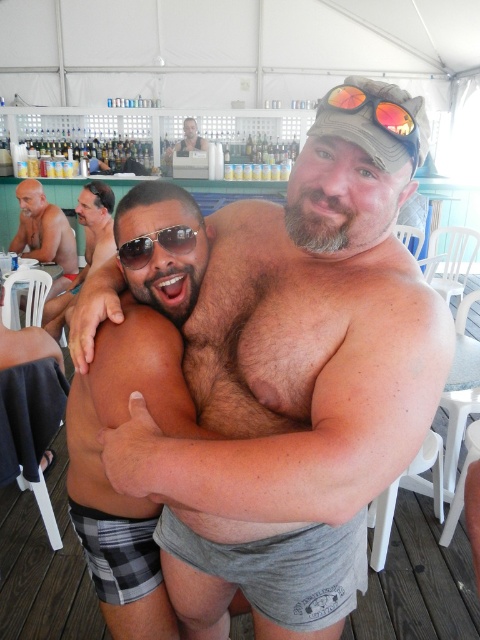
Question: Which of these objects is positioned farthest from the sunglasses at center?

Choices:
 (A) smooth skin man at center
 (B) beige plaid shorts at left
 (C) gray fabric shorts at center

Answer: (A)

Question: Among these points, which one is farthest from the camera?

Choices:
 (A) (409, 134)
 (B) (96, 230)
 (C) (331, 228)
 (D) (38, 236)

Answer: (D)

Question: Which object is closer to the camera taking this photo?

Choices:
 (A) bald head at left
 (B) reflective plastic goggles at upper center
 (C) gray fabric shorts at center
 (D) smooth skin man at center

Answer: (C)

Question: Considering the relative positions of beige plaid shorts at left and sunglasses at center in the image provided, where is beige plaid shorts at left located with respect to sunglasses at center?

Choices:
 (A) above
 (B) below

Answer: (A)

Question: Is gray fabric shorts at center to the left of bald head at left from the viewer's perspective?

Choices:
 (A) yes
 (B) no

Answer: (B)

Question: Does gray fabric shorts at center lie in front of bald head at left?

Choices:
 (A) yes
 (B) no

Answer: (A)